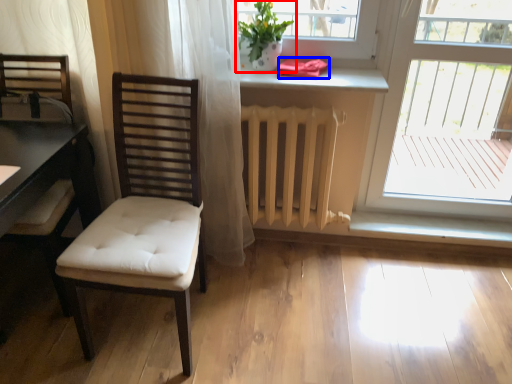
Question: Among these objects, which one is farthest to the camera, houseplant (highlighted by a red box) or towel/napkin (highlighted by a blue box)?

Choices:
 (A) houseplant
 (B) towel/napkin

Answer: (B)